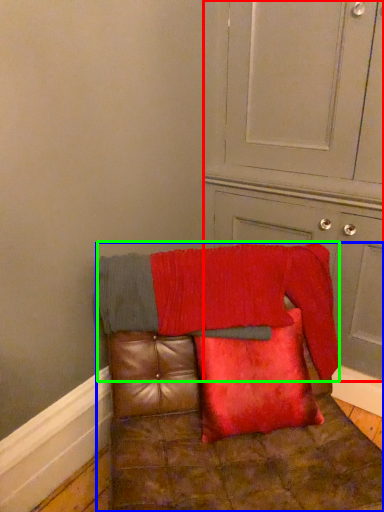
Question: Which object is the closest to the dresser (highlighted by a red box)? Choose among these: furniture (highlighted by a blue box) or blanket (highlighted by a green box).

Choices:
 (A) furniture
 (B) blanket

Answer: (B)